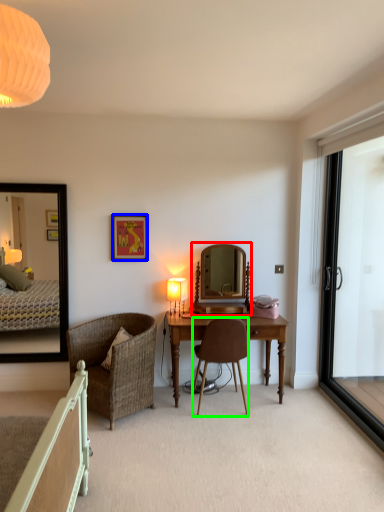
Question: Which object is positioned farthest from mirror (highlighted by a red box)? Select from picture frame (highlighted by a blue box) and chair (highlighted by a green box).

Choices:
 (A) picture frame
 (B) chair

Answer: (A)